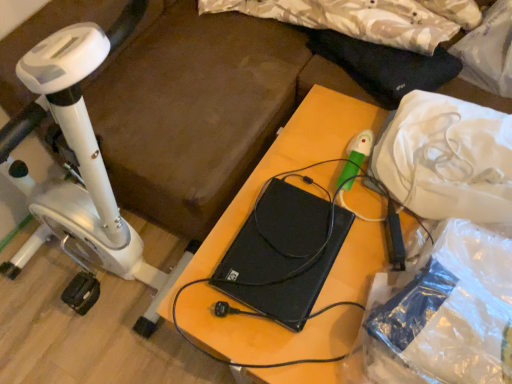
Question: Would you say black matte laptop at center is inside or outside white plastic bag at upper right?

Choices:
 (A) outside
 (B) inside

Answer: (A)

Question: In the image, is black matte laptop at center positioned in front of or behind white plastic bag at upper right?

Choices:
 (A) front
 (B) behind

Answer: (A)

Question: Estimate the real-world distances between objects in this image. Which object is farther from the white plastic bag at upper right?

Choices:
 (A) white plastic stationary bicycle at left
 (B) black matte laptop at center
 (C) black matte laptop at center

Answer: (A)

Question: Based on their relative distances, which object is nearer to the black matte laptop at center?

Choices:
 (A) black matte laptop at center
 (B) white plastic stationary bicycle at left
 (C) white plastic bag at upper right

Answer: (A)